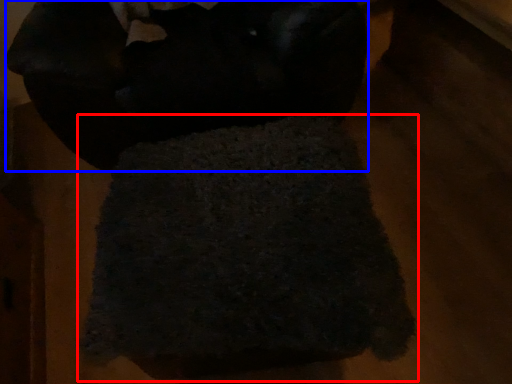
Question: Which point is closer to the camera, towel (highlighted by a red box) or wool (highlighted by a blue box)?

Choices:
 (A) towel
 (B) wool

Answer: (A)